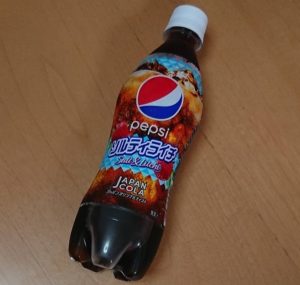
What are the coordinates of `brown hardwood surface` in the screenshot? It's located at (x=100, y=76), (x=70, y=191), (x=240, y=156), (x=258, y=235).